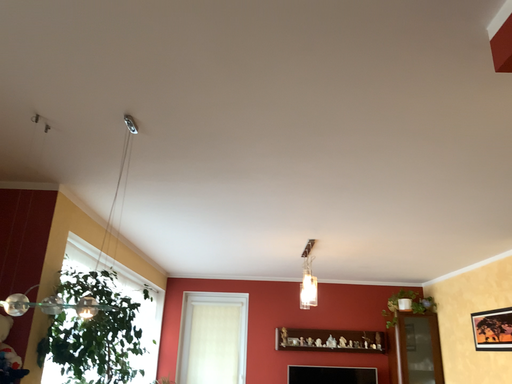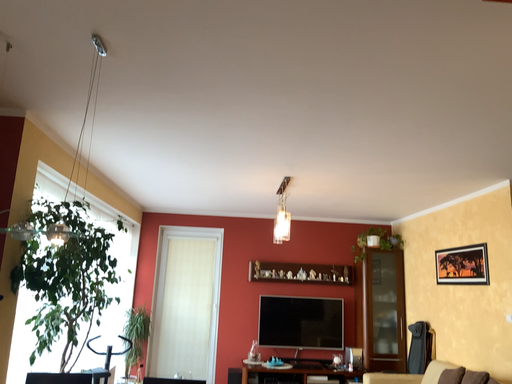
Question: Which way did the camera rotate in the video?

Choices:
 (A) rotated upward
 (B) rotated downward

Answer: (B)